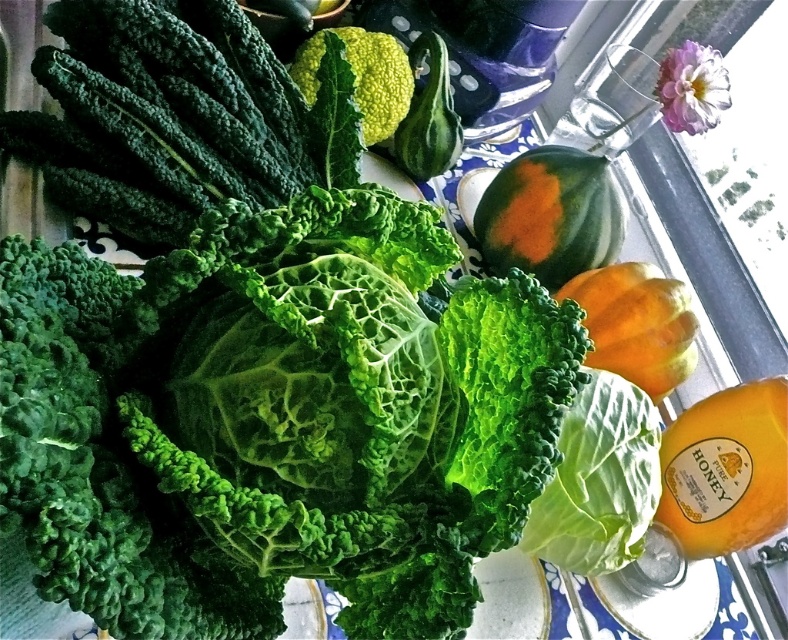
Does translucent glass bottle of orange juice at lower right come in front of orange-fleshed squash at center?

Yes, it is in front of orange-fleshed squash at center.

Which is behind, point (668, 500) or point (493, 237)?

The point (493, 237) is behind.

Identify the location of translucent glass bottle of orange juice at lower right. [x=727, y=468].

Does point (567, 221) lie behind point (404, 92)?

That is False.

Which of these two, orange-fleshed squash at center or green textured broccoli at center, stands shorter?

With less height is orange-fleshed squash at center.

Is point (523, 266) in front of point (400, 68)?

That is False.

Identify the location of orange-fleshed squash at center. This screenshot has width=788, height=640. (549, 216).

Between green textured broccoli at center and green matte squash at center, which one is positioned higher?

green matte squash at center is above.

Does green textured broccoli at center have a greater height compared to green matte squash at center?

Indeed, green textured broccoli at center has a greater height compared to green matte squash at center.

This screenshot has height=640, width=788. I want to click on green textured broccoli at center, so (x=362, y=76).